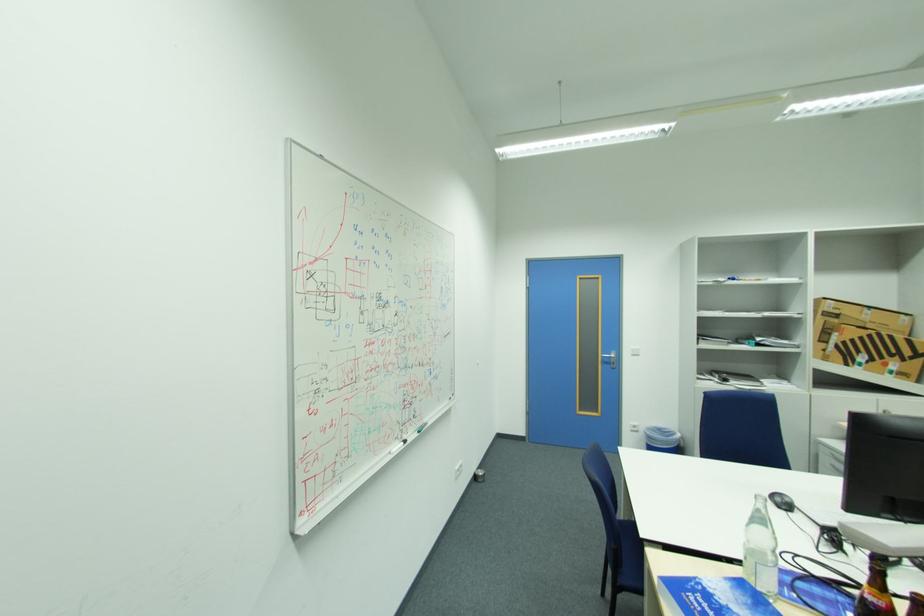
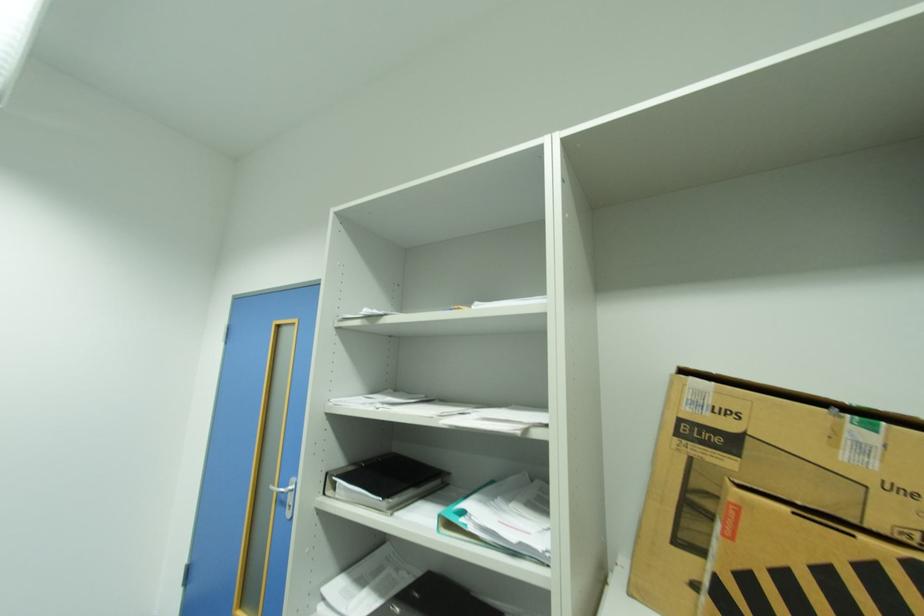
In a continuous first-person perspective shot, in which direction is the camera moving?

The cameraman moved toward right, forward.